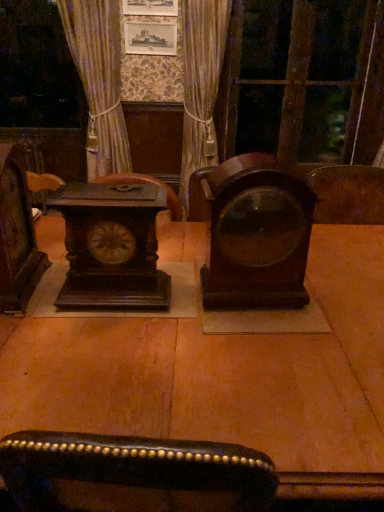
Find the location of a particular element. Image resolution: width=384 pixels, height=512 pixels. vacant area that is situated to the right of mahogany wood alarm clock at center, the 2th alarm clock positioned from the left is located at coordinates (335, 297).